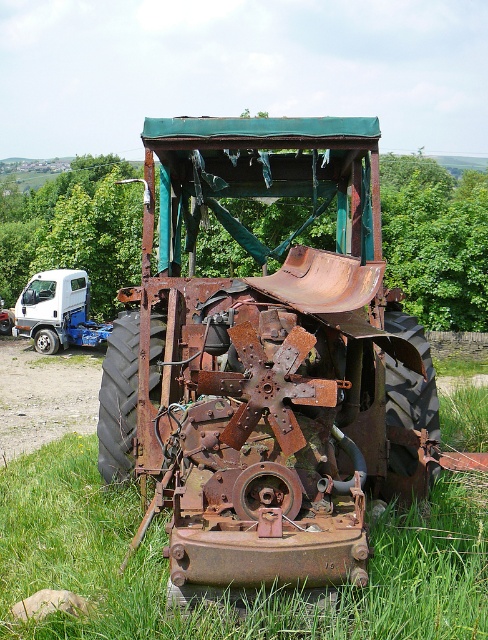
You are a photographer planning to capture the rusty metal tractor at center and the white matte truck at left. Based on their positions, which one would appear larger in the photo if you focus on the tractor?

The rusty metal tractor at center would appear larger in the photo because it is positioned closer to the camera than the white matte truck at left, which is further away.

You are a photographer trying to capture both the rusty metal tractor at center and the white matte truck at left in a single frame. Which object should you position closer to the camera to ensure both are fully visible without cropping?

The rusty metal tractor at center is thinner than the white matte truck at left, so positioning the white matte truck at left closer to the camera will allow both objects to fit within the frame without cropping.